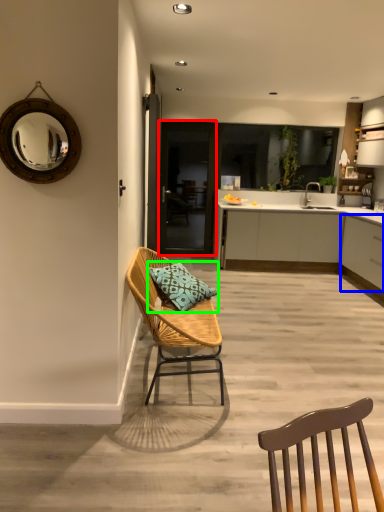
Question: Which object is positioned farthest from glass door (highlighted by a red box)? Select from cabinetry (highlighted by a blue box) and pillow (highlighted by a green box).

Choices:
 (A) cabinetry
 (B) pillow

Answer: (B)